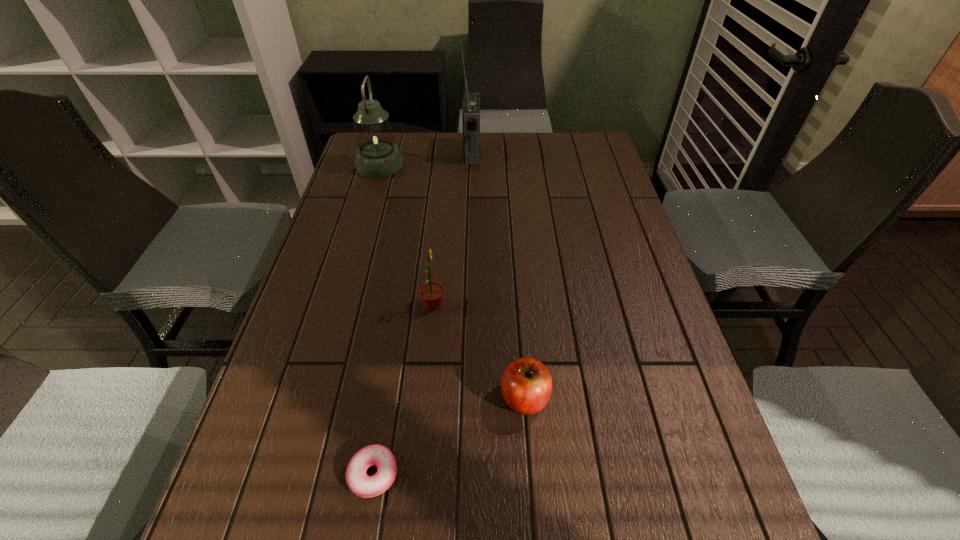
The width and height of the screenshot is (960, 540). In order to click on radio receiver in this screenshot , I will do `click(471, 101)`.

This screenshot has width=960, height=540. I want to click on the tallest object, so click(471, 101).

Locate an element on the screen. The height and width of the screenshot is (540, 960). the second tallest object is located at coordinates (378, 156).

The image size is (960, 540). In order to click on the leftmost object in this screenshot , I will do `click(378, 156)`.

Image resolution: width=960 pixels, height=540 pixels. I want to click on the third tallest object, so click(x=431, y=293).

Identify the location of sunflower. This screenshot has height=540, width=960. (431, 293).

Image resolution: width=960 pixels, height=540 pixels. In order to click on apple in this screenshot , I will do `click(526, 385)`.

Find the location of a particular element. the fourth farthest object is located at coordinates (526, 385).

At what (x,y) coordinates should I click in order to perform the action: click on the shortest object. Please return your answer as a coordinate pair (x, y). The image size is (960, 540). Looking at the image, I should click on (362, 485).

Where is `the fourth object from right to left`? Image resolution: width=960 pixels, height=540 pixels. the fourth object from right to left is located at coordinates (362, 485).